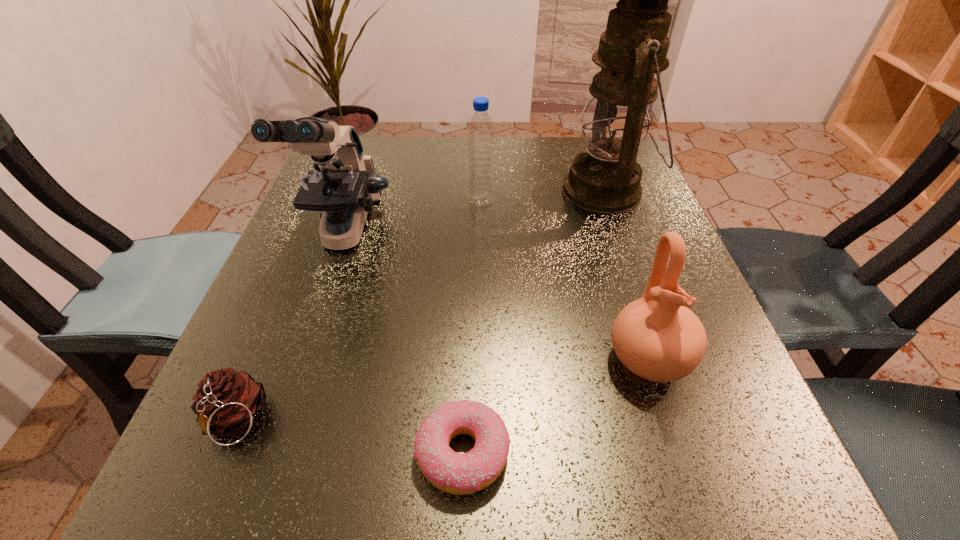
Locate an element on the screen. This screenshot has height=540, width=960. oil lamp is located at coordinates (605, 179).

I want to click on the second tallest object, so click(x=345, y=188).

You are a GUI agent. You are given a task and a screenshot of the screen. Output one action in this format:
    pyautogui.click(x=<x>, y=<y>)
    Task: Click on the water bottle
    The image size is (960, 540).
    Given the screenshot: What is the action you would take?
    pyautogui.click(x=480, y=135)

Locate an element on the screen. This screenshot has height=540, width=960. pottery is located at coordinates (656, 337).

Identify the location of the fifth tallest object. Image resolution: width=960 pixels, height=540 pixels. (228, 403).

This screenshot has width=960, height=540. In order to click on doughnut in this screenshot , I will do `click(456, 473)`.

This screenshot has height=540, width=960. Identify the location of blank area located 0.160m on the left of the oil lamp. (490, 191).

Where is `free space located through the eyepieces of the microscope`? The image size is (960, 540). free space located through the eyepieces of the microscope is located at coordinates (276, 436).

Where is `vacant region located on the back of the water bottle`? vacant region located on the back of the water bottle is located at coordinates (481, 166).

Locate an element on the screen. free space located 0.050m with a leaf charm attached to the second shortest object is located at coordinates (202, 503).